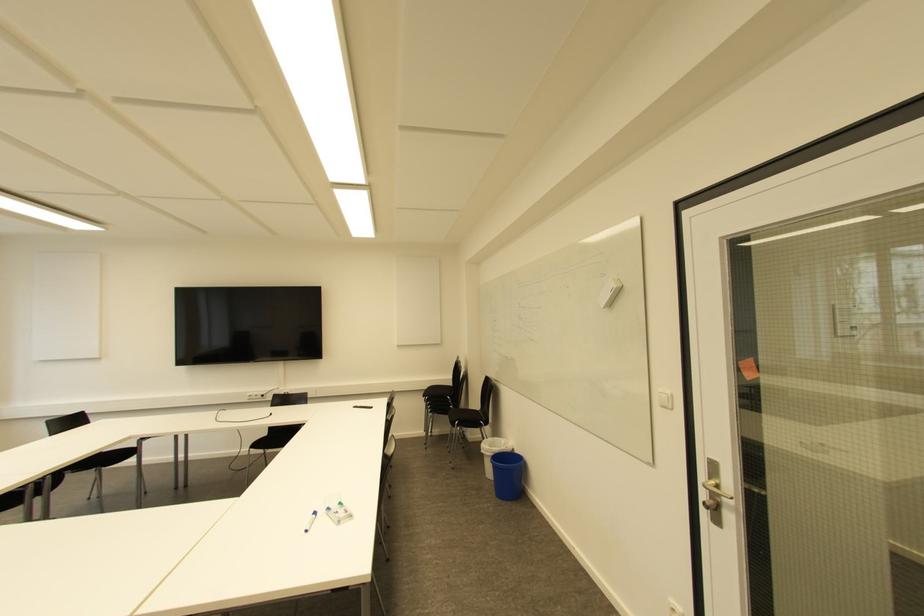
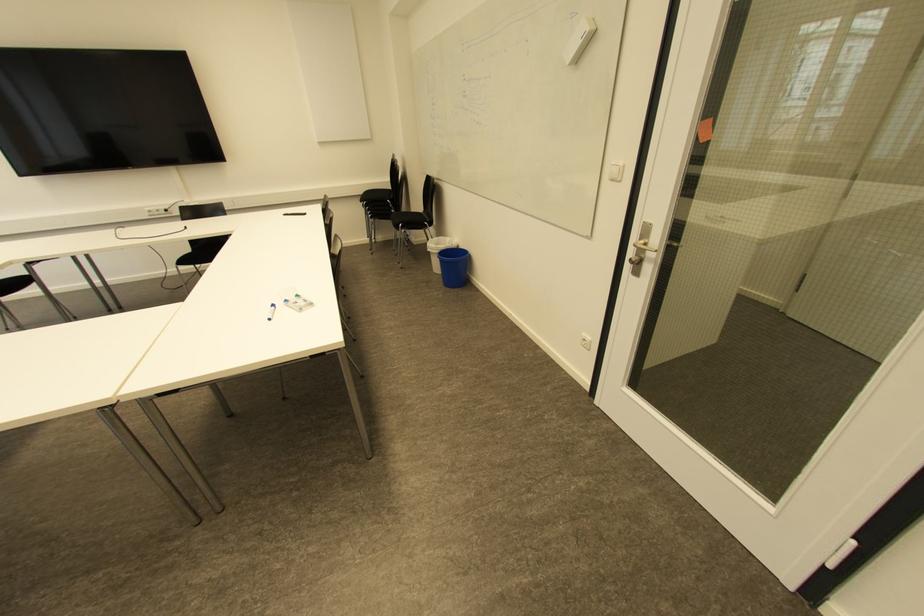
Find the pixel in the second image that matches point 476,419 in the first image.

(419, 222)